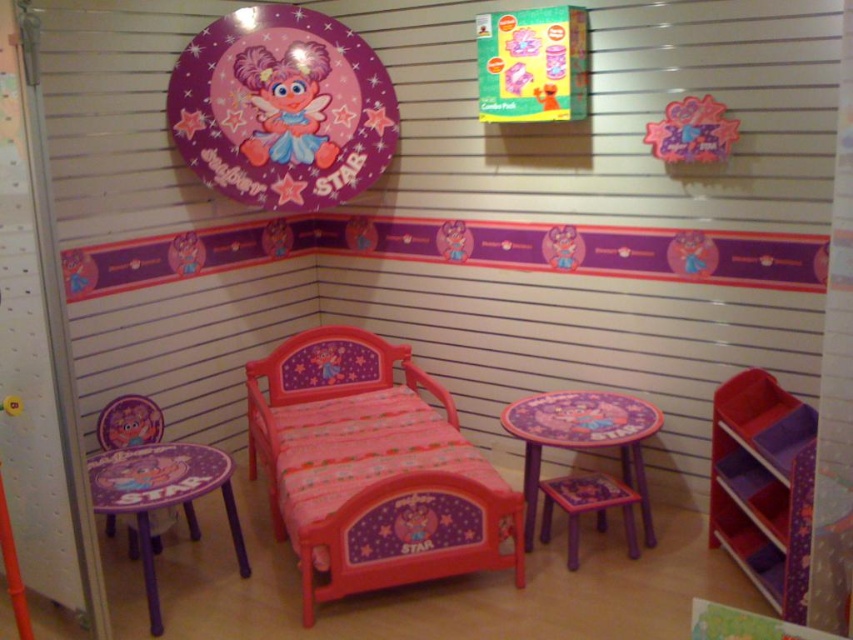
Question: Does matte plastic bed at center appear on the left side of purple plastic table at center?

Choices:
 (A) yes
 (B) no

Answer: (A)

Question: Is matte plastic bed at center closer to the viewer compared to purple plastic table at lower left?

Choices:
 (A) no
 (B) yes

Answer: (A)

Question: Which object appears farthest from the camera in this image?

Choices:
 (A) purple plastic table at center
 (B) purple plastic table at lower left

Answer: (A)

Question: Among these points, which one is farthest from the camera?

Choices:
 (A) (257, 419)
 (B) (212, 184)

Answer: (A)

Question: Is purple plastic table at center further to camera compared to matte pink doll at upper center?

Choices:
 (A) no
 (B) yes

Answer: (A)

Question: Which is farther from the purple plastic stool at lower center?

Choices:
 (A) matte plastic plate at upper center
 (B) purple plastic table at center
 (C) matte pink doll at upper center

Answer: (C)